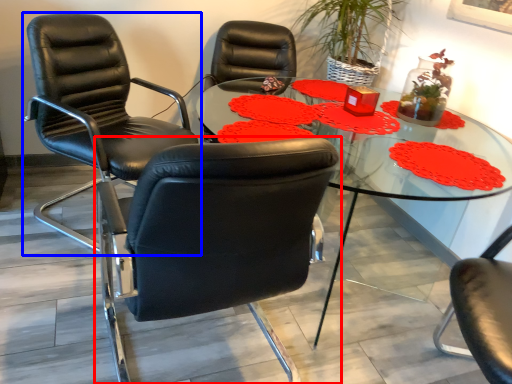
Question: Which point is further to the camera, chair (highlighted by a red box) or chair (highlighted by a blue box)?

Choices:
 (A) chair
 (B) chair

Answer: (B)